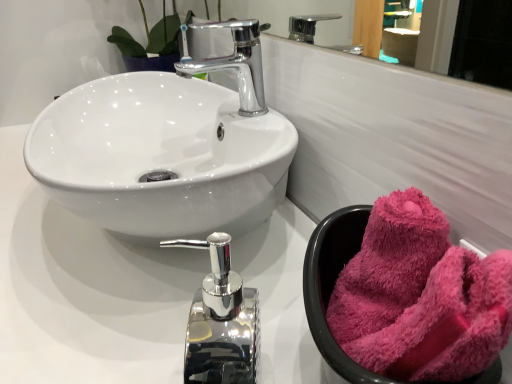
Question: In which direction should I rotate to look at polished chrome tap at center, which ranks as the 2th tap in top-to-bottom order?

Choices:
 (A) right
 (B) left

Answer: (B)

Question: From a real-world perspective, is fuzzy pink towel at right on top of polished chrome tap at center, which ranks as the 1th tap in front-to-back order?

Choices:
 (A) no
 (B) yes

Answer: (B)

Question: Would you say fuzzy pink towel at right contains polished chrome tap at center, which ranks as the 2th tap in top-to-bottom order?

Choices:
 (A) yes
 (B) no

Answer: (B)

Question: Considering the relative positions of fuzzy pink towel at right and polished chrome tap at center, which ranks as the 2th tap in back-to-front order, in the image provided, is fuzzy pink towel at right to the right of polished chrome tap at center, which ranks as the 2th tap in back-to-front order, from the viewer's perspective?

Choices:
 (A) yes
 (B) no

Answer: (A)

Question: Considering the relative sizes of fuzzy pink towel at right and polished chrome tap at center, which ranks as the 2th tap in back-to-front order, in the image provided, is fuzzy pink towel at right bigger than polished chrome tap at center, which ranks as the 2th tap in back-to-front order,?

Choices:
 (A) yes
 (B) no

Answer: (B)

Question: Can you confirm if fuzzy pink towel at right is thinner than polished chrome tap at center, which ranks as the 2th tap in top-to-bottom order?

Choices:
 (A) no
 (B) yes

Answer: (A)

Question: Is fuzzy pink towel at right touching polished chrome tap at center, which ranks as the 1th tap in front-to-back order?

Choices:
 (A) yes
 (B) no

Answer: (B)

Question: Does polished chrome tap at center, which ranks as the 2th tap in back-to-front order, have a greater height compared to glossy chrome mirror at upper center?

Choices:
 (A) yes
 (B) no

Answer: (A)

Question: Considering the relative sizes of polished chrome tap at center, which ranks as the 2th tap in back-to-front order, and glossy chrome mirror at upper center in the image provided, is polished chrome tap at center, which ranks as the 2th tap in back-to-front order, bigger than glossy chrome mirror at upper center?

Choices:
 (A) no
 (B) yes

Answer: (B)

Question: From the image's perspective, would you say polished chrome tap at center, which ranks as the 2th tap in back-to-front order, is positioned over glossy chrome mirror at upper center?

Choices:
 (A) no
 (B) yes

Answer: (A)

Question: Can you confirm if polished chrome tap at center, positioned as the 1th tap in bottom-to-top order, is thinner than glossy chrome mirror at upper center?

Choices:
 (A) no
 (B) yes

Answer: (A)

Question: From a real-world perspective, is polished chrome tap at center, positioned as the 1th tap in bottom-to-top order, on glossy chrome mirror at upper center?

Choices:
 (A) no
 (B) yes

Answer: (A)

Question: Is polished chrome tap at center, which ranks as the 2th tap in top-to-bottom order, with glossy chrome mirror at upper center?

Choices:
 (A) no
 (B) yes

Answer: (A)

Question: Can you confirm if fuzzy pink towel at right is taller than glossy chrome mirror at upper center?

Choices:
 (A) no
 (B) yes

Answer: (B)